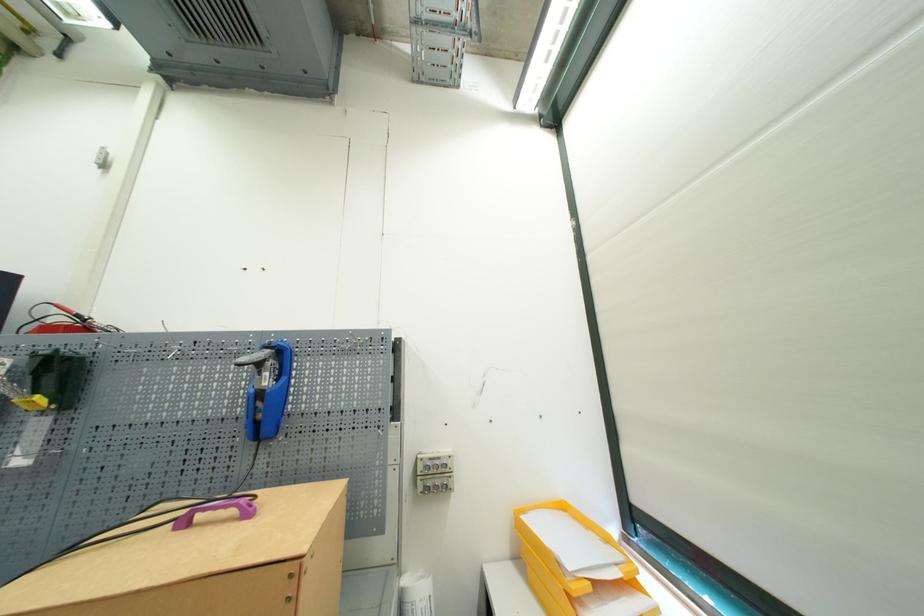
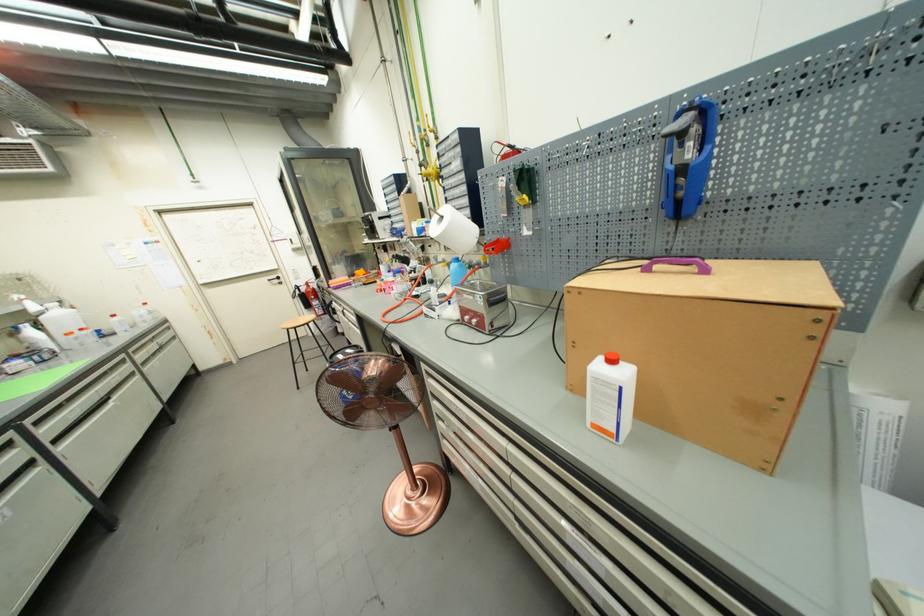
Find the pixel in the second image that matches the point at 266,379 in the first image.

(689, 152)